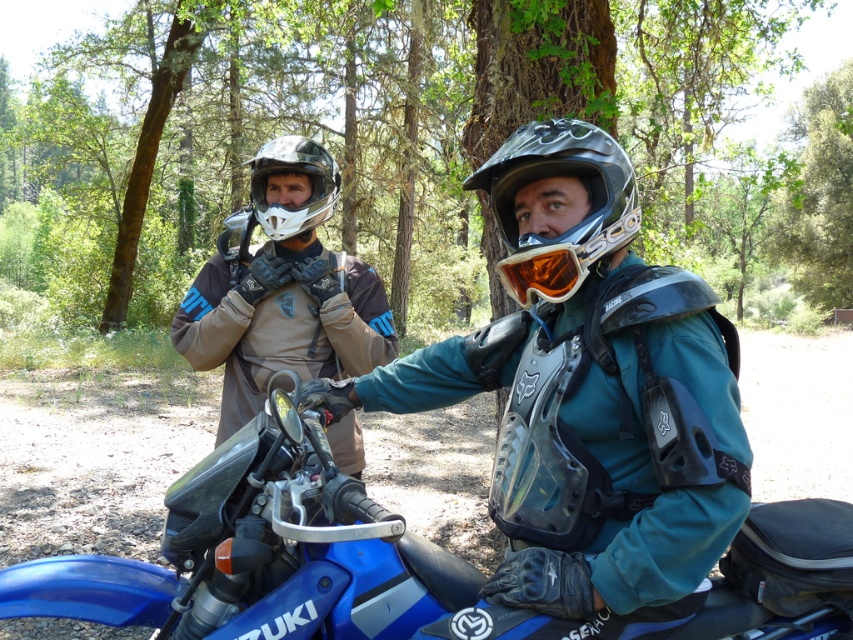
What is the object located at the coordinate point (x=424, y=141) in the image?

The object located at the coordinate point (x=424, y=141) is a brown bark tree at center.

You are a photographer positioned behind the two riders in the forest scene. You need to capture a clear photo of the teal matte jacket at center without the blue metallic motorcycle at center blocking it. Is this possible based on their positions?

The teal matte jacket at center is in front of the blue metallic motorcycle at center, so the motorcycle is already blocking the jacket. Therefore, it is not possible to capture a clear photo of the teal matte jacket at center without the motorcycle blocking it.

You are a photographer positioned to the side of the scene. You want to capture a photo where both the blue metallic motorcycle at center and the matte black helmet at upper center are clearly visible. Considering their sizes, which object will appear wider in the photo?

The blue metallic motorcycle at center will appear wider in the photo because its width surpasses that of the matte black helmet at upper center.